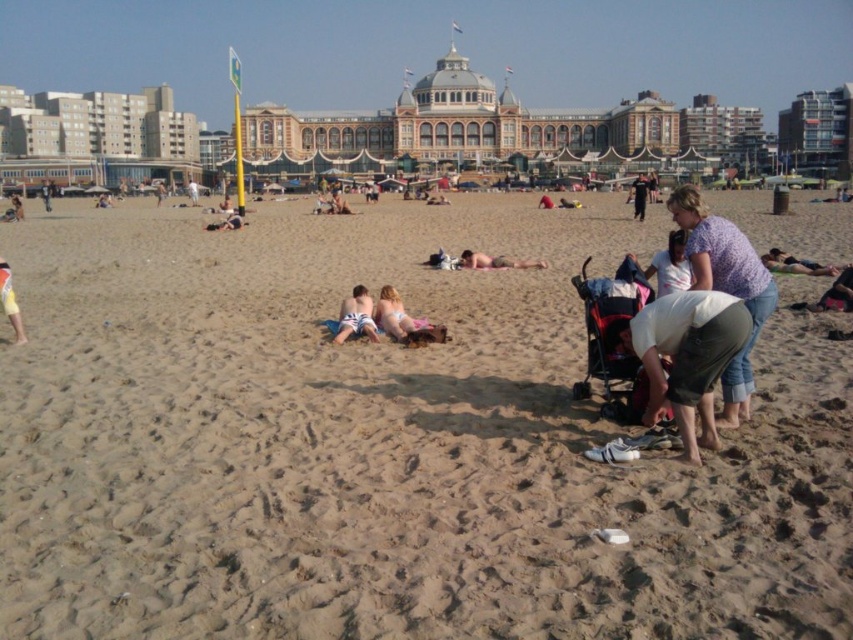
You are a photographer trying to capture a candid shot of the beach scene. You notice the smooth sand at center and the dark blue jeans at center. Which object is positioned higher in the frame?

The smooth sand at center is taller than the dark blue jeans at center, so the smooth sand at center is positioned higher in the frame.

In the scene shown: You are standing on the beach and see both the smooth sand at center and the dark blue jeans at center. Which one is nearer to you?

The smooth sand at center is closer to the viewer than the dark blue jeans at center.

You are a photographer trying to capture the white cotton shirt at lower right. Based on the scene description, where exactly should you position your camera to ensure it is in frame?

To capture the white cotton shirt at lower right, position your camera at point (688, 356) as specified in the scene description.